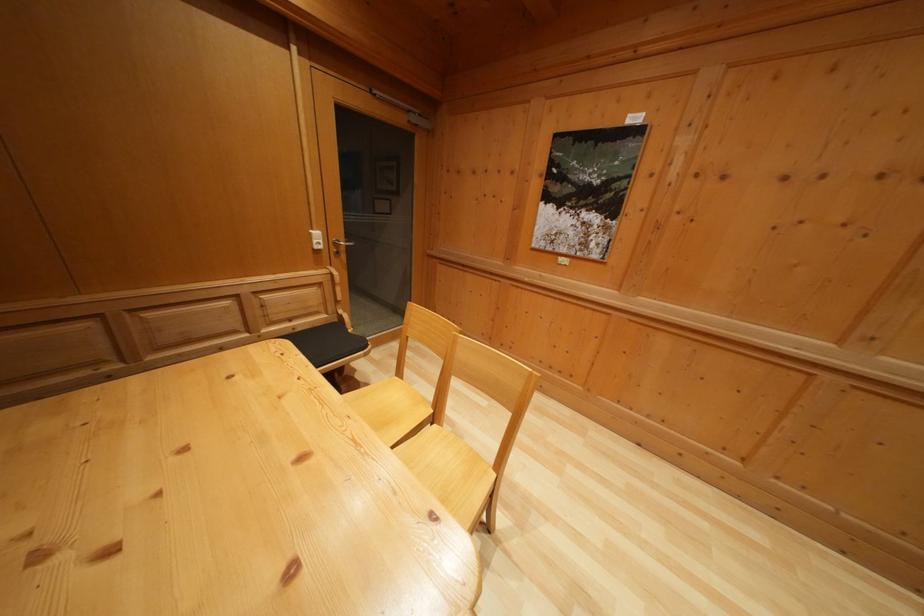
Find where to sit the chair sitting surface. Please return your answer as a coordinate pair (x, y).

(391, 408)